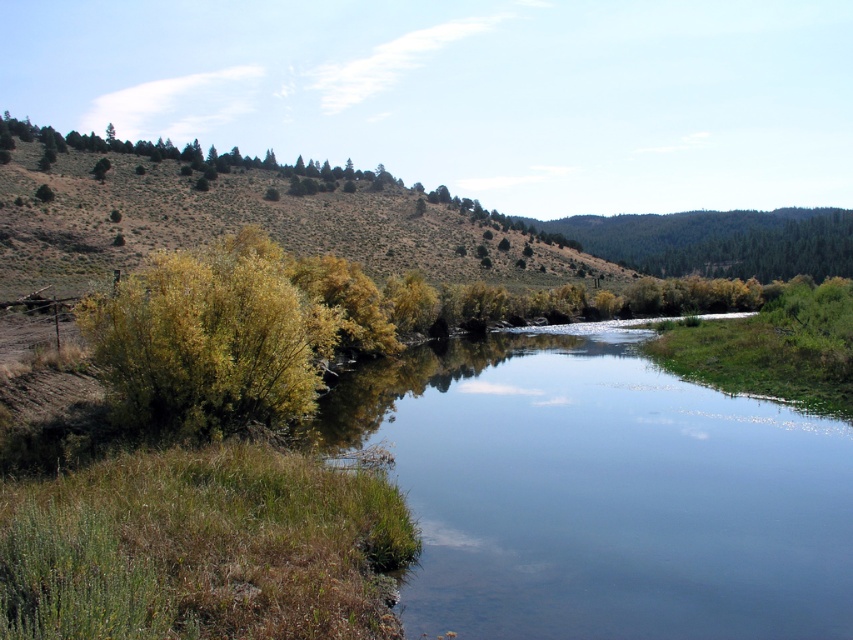
You are an environmental scientist analyzing the landscape. You observe the green shrubbery at upper left and the green leafy bush at left. Which of these two plants is positioned higher in the image?

The green shrubbery at upper left is positioned higher in the image than the green leafy bush at left.

You are a hiker trying to cross the river. You notice the clear water at center and the green shrubbery at upper left. Which area takes up more space in the image?

The green shrubbery at upper left occupies more space than the clear water at center in the image.